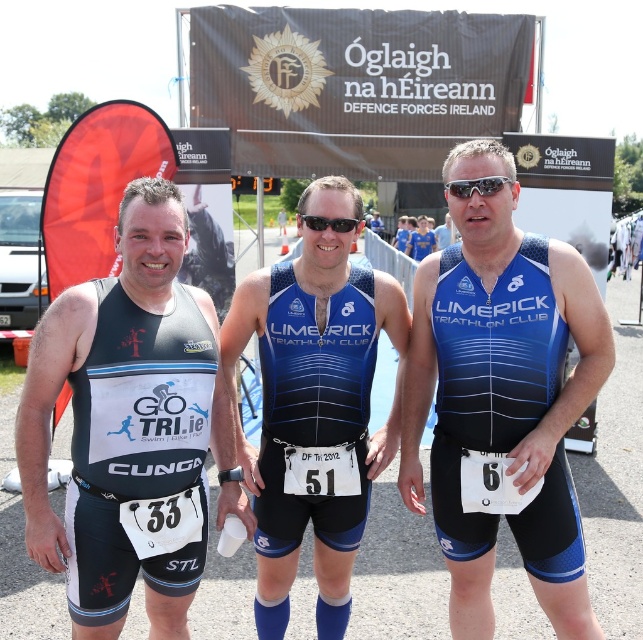
Who is taller, matte black triathlon suit at center or sunglasses at center?

matte black triathlon suit at center is taller.

Does point (168, 336) lie behind point (446, 182)?

That is False.

Which is behind, point (87, 461) or point (498, 176)?

Positioned behind is point (498, 176).

This screenshot has width=643, height=640. I want to click on matte black triathlon suit at center, so click(x=131, y=428).

Locate an element on the screen. This screenshot has width=643, height=640. blue matte triathlon suit at center is located at coordinates (502, 394).

Between blue matte triathlon suit at center and black plastic goggles at center, which one has more height?

blue matte triathlon suit at center

Is point (588, 355) closer to viewer compared to point (316, 218)?

That is True.

The image size is (643, 640). I want to click on blue matte triathlon suit at center, so pos(502,394).

Who is taller, blue matte triathlon suit at center or blue/black triathlon suit at center?

Standing taller between the two is blue/black triathlon suit at center.

Which is more to the left, blue matte triathlon suit at center or blue/black triathlon suit at center?

From the viewer's perspective, blue/black triathlon suit at center appears more on the left side.

Which is in front, point (440, 500) or point (294, 419)?

Point (440, 500) is in front.

This screenshot has width=643, height=640. In order to click on blue matte triathlon suit at center in this screenshot , I will do `click(502, 394)`.